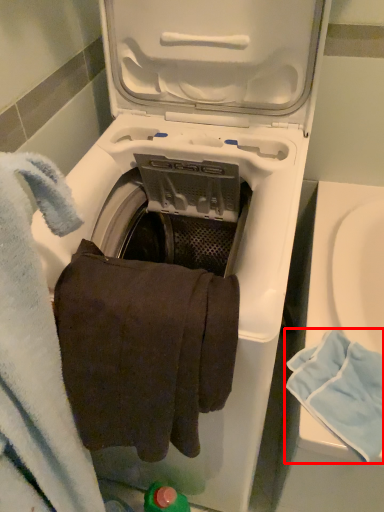
Question: In this image, where is bath towel (annotated by the red box) located relative to bath towel?

Choices:
 (A) left
 (B) right

Answer: (B)